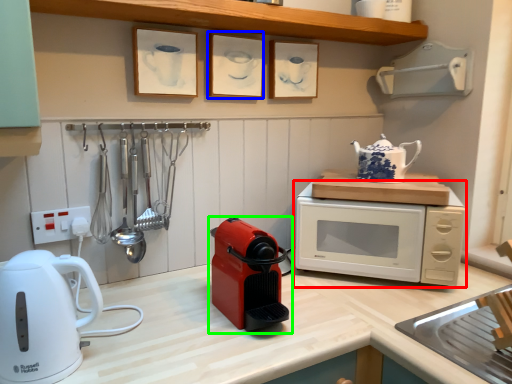
Question: Estimate the real-world distances between objects in this image. Which object is farther from microwave oven (highlighted by a red box), picture frame (highlighted by a blue box) or home appliance (highlighted by a green box)?

Choices:
 (A) picture frame
 (B) home appliance

Answer: (A)